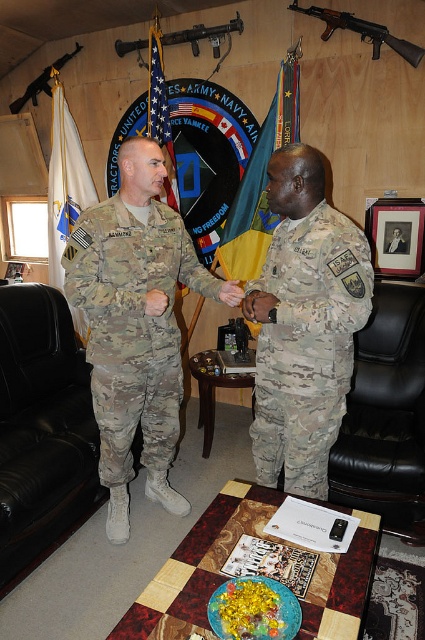
Can you confirm if camouflage fabric uniform at center is positioned above camouflage fabric uniform at left?

No.

Can you confirm if camouflage fabric uniform at center is positioned below camouflage fabric uniform at left?

Yes, camouflage fabric uniform at center is below camouflage fabric uniform at left.

Who is more forward, (x=354, y=234) or (x=149, y=349)?

Positioned in front is point (x=354, y=234).

This screenshot has height=640, width=425. I want to click on camouflage fabric uniform at center, so click(306, 344).

Can you confirm if camouflage fabric uniform at center is smaller than matte black rifle at upper left?

No.

Which is behind, point (340, 340) or point (10, 109)?

The point (10, 109) is behind.

Where is `camouflage fabric uniform at center`? camouflage fabric uniform at center is located at coordinates (306, 344).

Locate an element on the screen. The height and width of the screenshot is (640, 425). camouflage fabric uniform at center is located at coordinates (306, 344).

Between blue fabric flag at center and matte black rifle at upper left, which one has more height?

blue fabric flag at center

Between point (170, 202) and point (76, 45), which one is positioned behind?

The point (76, 45) is more distant.

I want to click on blue fabric flag at center, so click(161, 115).